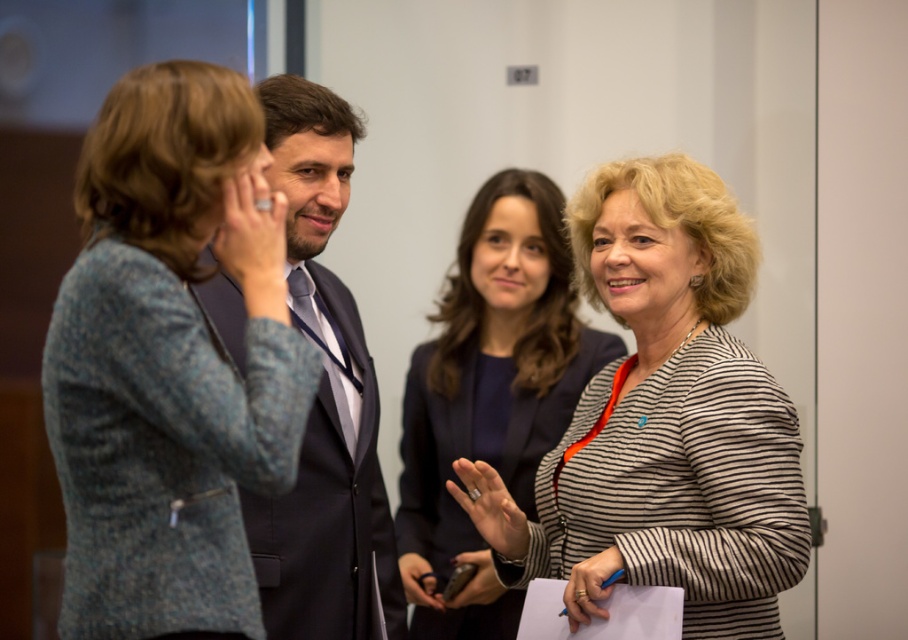
Is textured gray blazer at left bigger than dark gray suit at center?

No, textured gray blazer at left is not bigger than dark gray suit at center.

Is point (87, 412) closer to camera compared to point (316, 88)?

Yes, it is in front of point (316, 88).

You are a GUI agent. You are given a task and a screenshot of the screen. Output one action in this format:
    pyautogui.click(x=<x>, y=<y>)
    Task: Click on the textured gray blazer at left
    The image size is (908, 640).
    Given the screenshot: What is the action you would take?
    pyautogui.click(x=170, y=362)

From the picture: Is textured gray blazer at left smaller than striped fabric at center?

Indeed, textured gray blazer at left has a smaller size compared to striped fabric at center.

Who is positioned more to the left, textured gray blazer at left or striped fabric at center?

textured gray blazer at left

This screenshot has height=640, width=908. Find the location of `textured gray blazer at left`. textured gray blazer at left is located at coordinates (170, 362).

Which of these two, striped fabric jacket at center or dark gray suit at center, stands taller?

Standing taller between the two is dark gray suit at center.

Who is more forward, (601, 208) or (333, 381)?

Point (333, 381) is more forward.

Identify the location of striped fabric jacket at center. (663, 420).